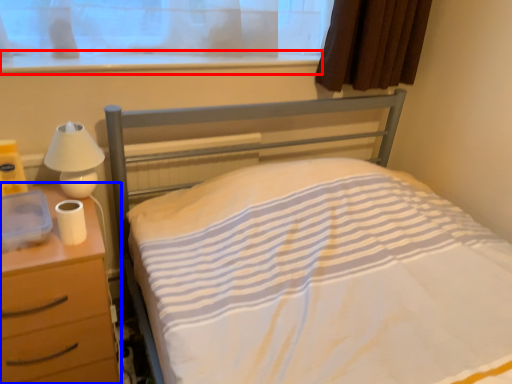
Question: Which of the following is the closest to the observer, window sill (highlighted by a red box) or nightstand (highlighted by a blue box)?

Choices:
 (A) window sill
 (B) nightstand

Answer: (B)